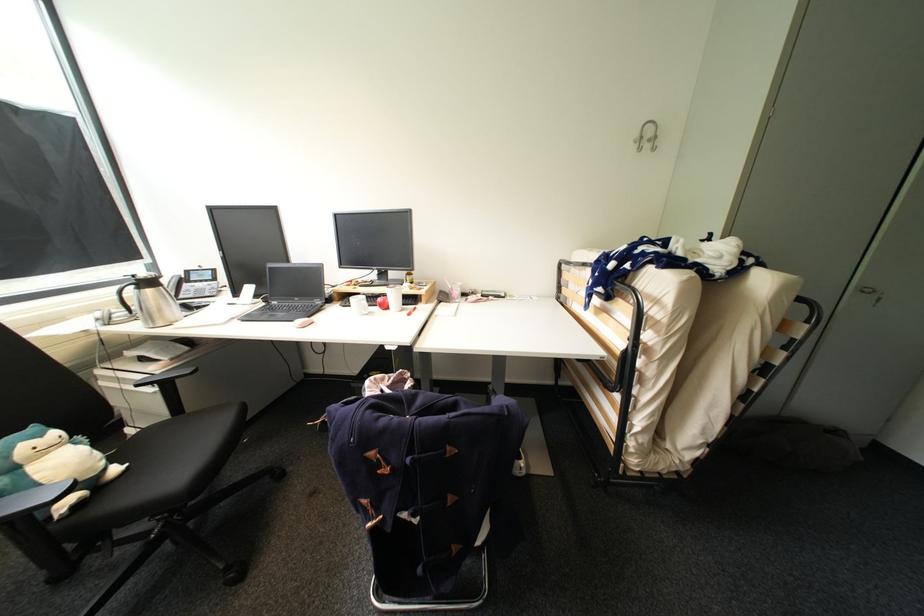
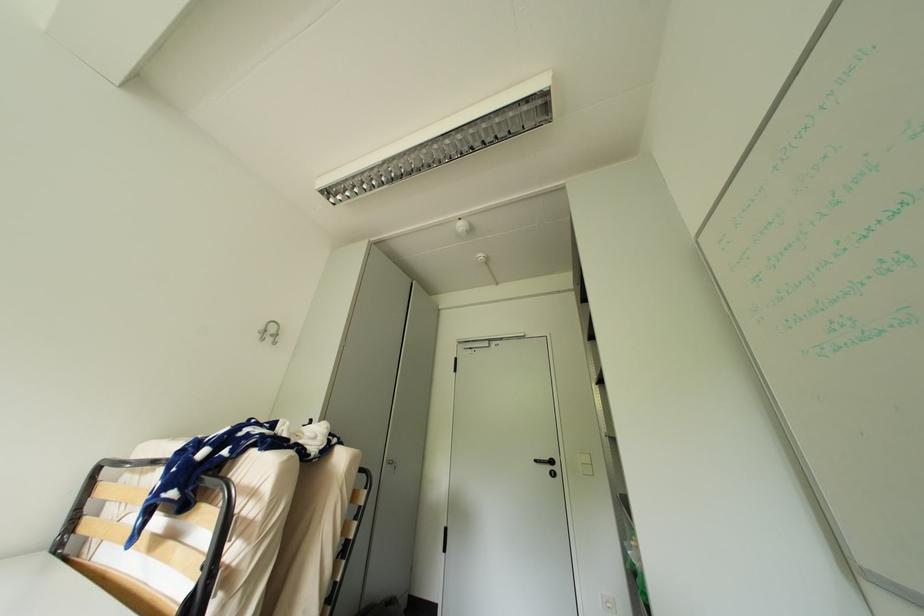
Based on the continuous images, in which direction is the camera rotating?

The rotation direction of the camera is right-up.